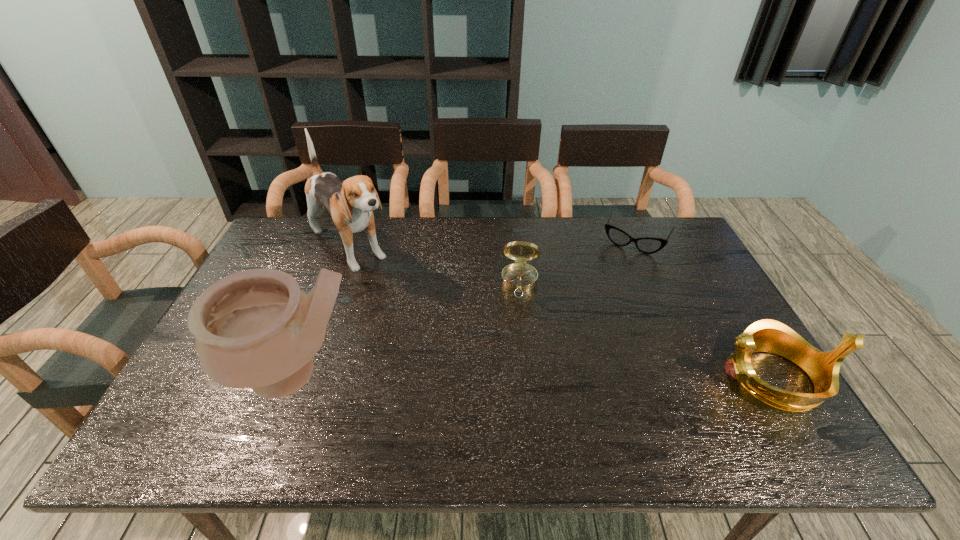
Locate an element on the screen. The height and width of the screenshot is (540, 960). pottery positioned at the near edge is located at coordinates (256, 329).

Identify the location of tiara that is at the near edge. (767, 335).

The image size is (960, 540). I want to click on pottery that is at the left edge, so click(x=256, y=329).

At what (x,y) coordinates should I click in order to perform the action: click on puppy located in the left edge section of the desktop. Please return your answer as a coordinate pair (x, y). Looking at the image, I should click on (351, 202).

Where is `tiara that is at the right edge`? The image size is (960, 540). tiara that is at the right edge is located at coordinates (767, 335).

Where is `spectacles positioned at the right edge`? spectacles positioned at the right edge is located at coordinates (648, 245).

The height and width of the screenshot is (540, 960). What are the coordinates of `object at the far left corner` in the screenshot? It's located at tap(351, 202).

At what (x,y) coordinates should I click in order to perform the action: click on object located at the near left corner. Please return your answer as a coordinate pair (x, y). The height and width of the screenshot is (540, 960). Looking at the image, I should click on (256, 329).

Find the location of a particular element. object located in the far right corner section of the desktop is located at coordinates (648, 245).

Locate an element on the screen. The width and height of the screenshot is (960, 540). object that is at the near right corner is located at coordinates (767, 335).